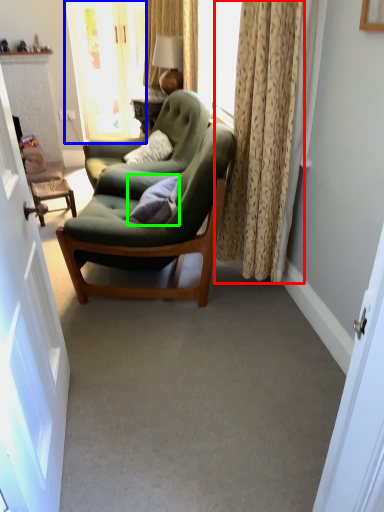
Question: Which object is the farthest from curtain (highlighted by a red box)? Choose among these: glass door (highlighted by a blue box) or pillow (highlighted by a green box).

Choices:
 (A) glass door
 (B) pillow

Answer: (A)